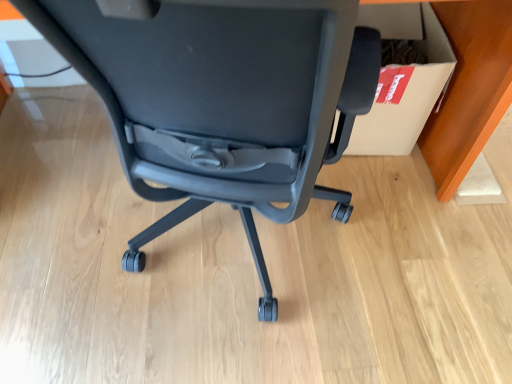
Find the location of a particular element. Image resolution: width=512 pixels, height=384 pixels. free spot below matte black chair at center (from a real-world perspective) is located at coordinates (237, 265).